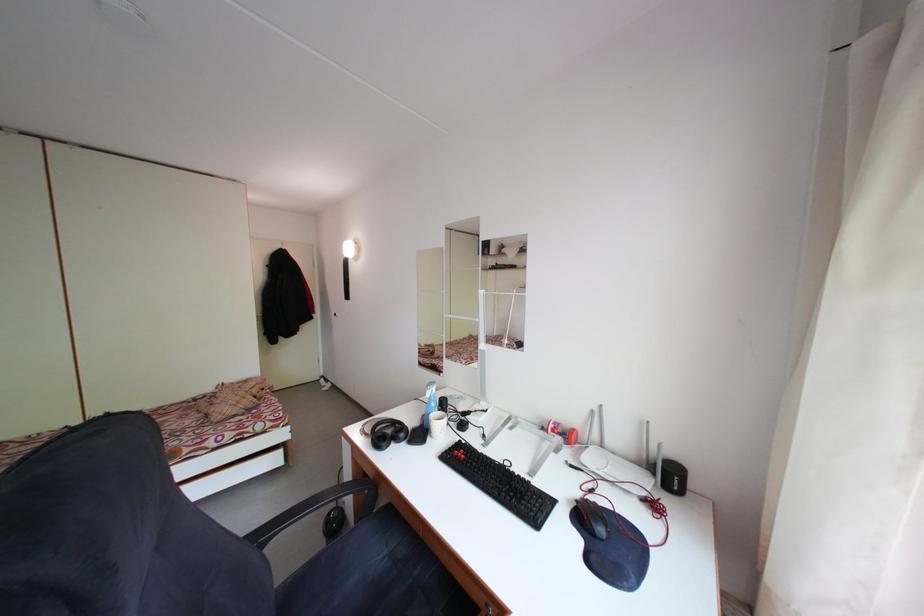
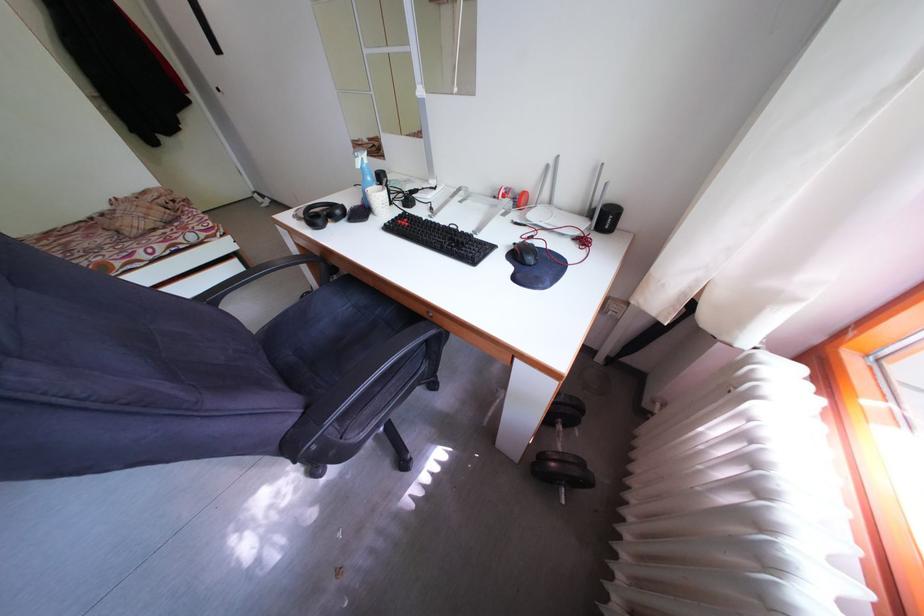
Where in the second image is the point corresponding to (x=436, y=400) from the first image?

(367, 171)